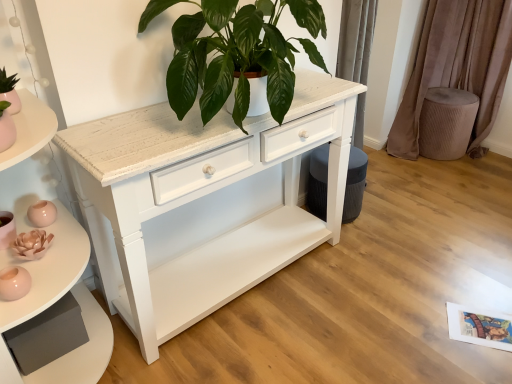
You are a GUI agent. You are given a task and a screenshot of the screen. Output one action in this format:
    pyautogui.click(x=<x>, y=<y>)
    Task: Click on the vacant area on top of white wood chest of drawers at center (from a real-world perspective)
    
    Given the screenshot: What is the action you would take?
    pyautogui.click(x=394, y=271)